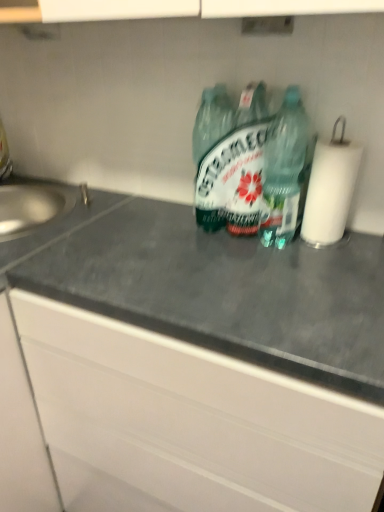
The height and width of the screenshot is (512, 384). Find the location of `free space in front of white paper at right`. free space in front of white paper at right is located at coordinates (333, 269).